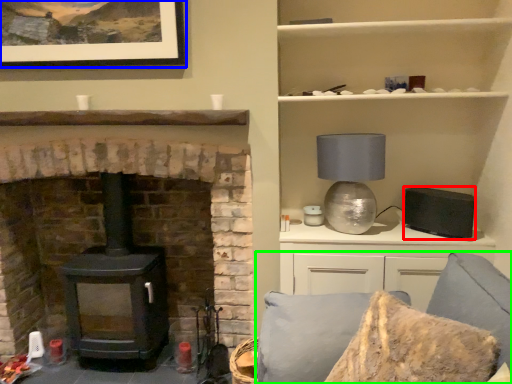
Question: Considering the real-world distances, which object is farthest from appliance (highlighted by a red box)? picture frame (highlighted by a blue box) or couch (highlighted by a green box)?

Choices:
 (A) picture frame
 (B) couch

Answer: (A)